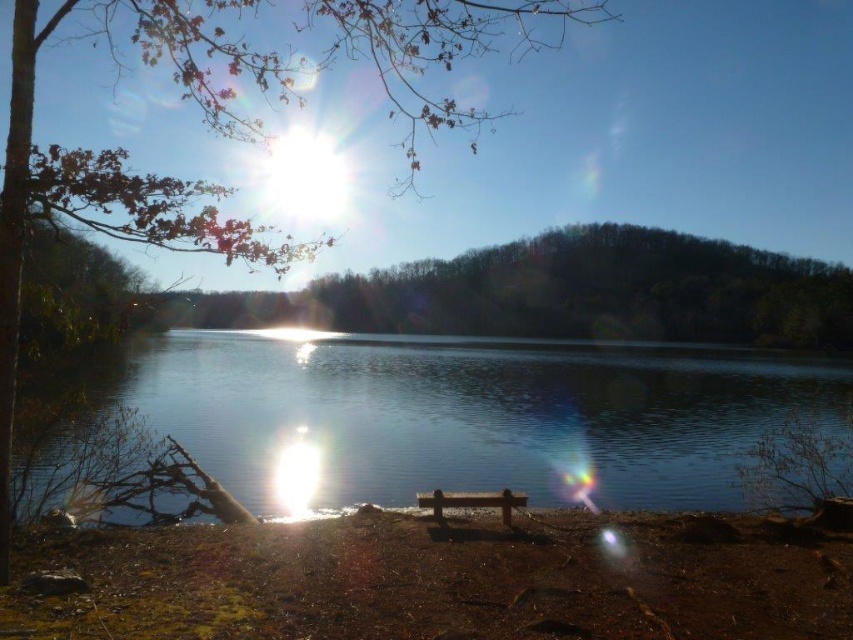
You are planning to take a photo of the clear water at center and the green leafy tree at center from the lakeside. Considering their widths, which object should you focus on first to ensure both are in the frame?

The clear water at center has a smaller width than the green leafy tree at center. To ensure both are in the frame, focus on the wider green leafy tree at center first, then adjust to include the narrower clear water at center.

You are sitting on the wooden bench on the dirt path. Looking at the clear water at center and the brown leafy tree at upper left, which object is closer to the sunlight in the upper left quadrant?

The brown leafy tree at upper left is closer to the sunlight in the upper left quadrant because it is positioned above the clear water at center.

You are a photographer planning to take a photo of the clear water at center and the green leafy tree at center. Based on their heights, which object should you focus on first if you want to ensure both are in sharp focus?

The clear water at center is shorter than the green leafy tree at center, so you should focus on the green leafy tree at center first to ensure both are in sharp focus.